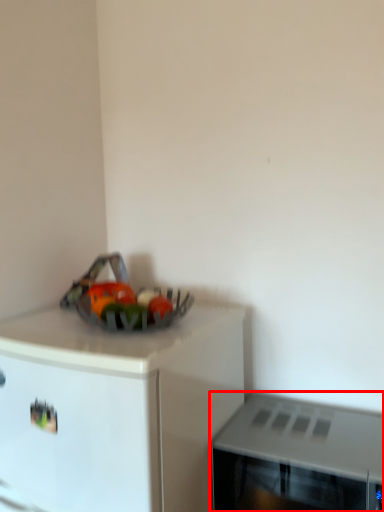
Question: From the image's perspective, what is the correct spatial relationship of microwave oven (annotated by the red box) in relation to cabinetry?

Choices:
 (A) below
 (B) above

Answer: (B)